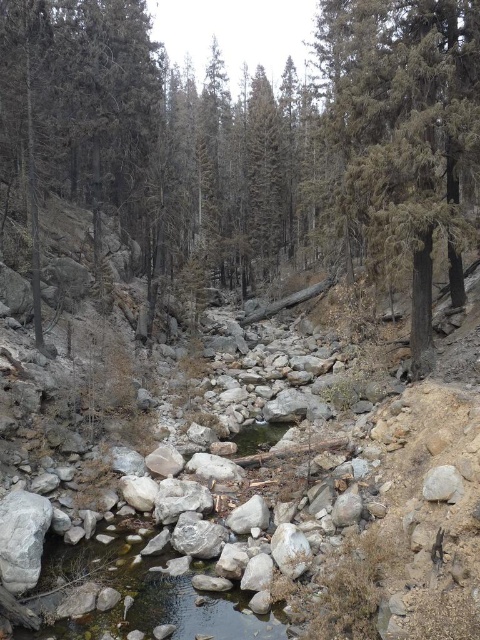
Question: Which of the following is the farthest from the observer?

Choices:
 (A) tap(433, 468)
 (B) tap(395, 248)
 (C) tap(60, 636)
 (D) tap(412, 316)

Answer: (D)

Question: Which point is closer to the camera taking this photo?

Choices:
 (A) click(x=392, y=109)
 (B) click(x=442, y=131)
 (C) click(x=90, y=625)

Answer: (C)

Question: Which object is closer to the camera taking this photo?

Choices:
 (A) charred wood tree at center
 (B) clear water at center
 (C) charred bark tree at center

Answer: (C)

Question: Observing the image, what is the correct spatial positioning of charred wood tree at center in reference to charred bark tree at center?

Choices:
 (A) below
 (B) above

Answer: (B)

Question: Does charred bark tree at center lie in front of gray rock stream at center?

Choices:
 (A) no
 (B) yes

Answer: (A)

Question: Can you confirm if charred bark tree at center is positioned to the left of clear water at center?

Choices:
 (A) no
 (B) yes

Answer: (A)